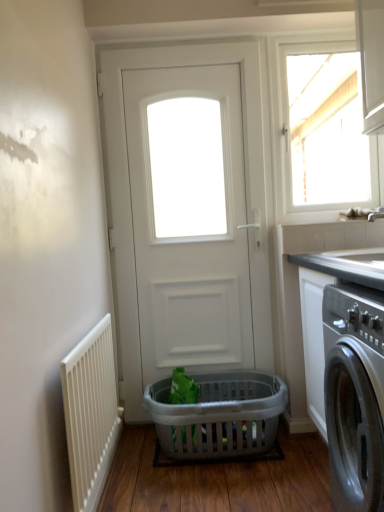
What do you see at coordinates (219, 415) in the screenshot? I see `translucent plastic basket at lower center` at bounding box center [219, 415].

What is the approximate width of translucent plastic basket at lower center?

18.19 inches.

Describe the element at coordinates (321, 309) in the screenshot. I see `smooth gray countertop at right` at that location.

Identify the location of white plastic radiator at lower left. The width and height of the screenshot is (384, 512). (90, 414).

From a real-world perspective, which is physically below, translucent plastic basket at lower center or white glossy window at upper right?

translucent plastic basket at lower center is physically lower.

Does translucent plastic basket at lower center have a greater width compared to white glossy window at upper right?

Correct, the width of translucent plastic basket at lower center exceeds that of white glossy window at upper right.

Is translucent plastic basket at lower center turned away from white glossy window at upper right?

That's not correct — translucent plastic basket at lower center is not looking away from white glossy window at upper right.

The image size is (384, 512). I want to click on door above the white plastic radiator at lower left (from the image's perspective), so point(246,174).

Between white matte door at center and white plastic radiator at lower left, which one has larger width?

With larger width is white matte door at center.

From a real-world perspective, between white matte door at center and white plastic radiator at lower left, who is vertically lower?

white plastic radiator at lower left is physically lower.

Can you see white matte door at center touching white plastic radiator at lower left?

No, white matte door at center is not beside white plastic radiator at lower left.

Between white matte door at center and translucent plastic basket at lower center, which one is positioned in front?

Positioned in front is translucent plastic basket at lower center.

Considering the sizes of objects white matte door at center and translucent plastic basket at lower center in the image provided, who is wider, white matte door at center or translucent plastic basket at lower center?

translucent plastic basket at lower center.

Based on the photo, does white matte door at center turn towards translucent plastic basket at lower center?

Yes.

Between point (112, 194) and point (162, 387), which one is positioned in front?

Positioned in front is point (162, 387).

Between white plastic radiator at lower left and white matte door at center, which one has larger width?

white matte door at center.

Considering the relative sizes of white plastic radiator at lower left and white matte door at center in the image provided, is white plastic radiator at lower left shorter than white matte door at center?

Yes, white plastic radiator at lower left is shorter than white matte door at center.

From a real-world perspective, is white plastic radiator at lower left under white matte door at center?

Correct, in the physical world, white plastic radiator at lower left is lower than white matte door at center.

I want to click on door that appears behind the white plastic radiator at lower left, so click(x=246, y=174).

Is white glossy window at upper right next to translucent plastic basket at lower center and touching it?

No, white glossy window at upper right is not making contact with translucent plastic basket at lower center.

In order to click on basket below the white glossy window at upper right (from a real-world perspective) in this screenshot , I will do `click(219, 415)`.

How distant is white glossy window at upper right from translucent plastic basket at lower center?

The distance of white glossy window at upper right from translucent plastic basket at lower center is 10.32 feet.

Between white glossy window at upper right and translucent plastic basket at lower center, which one has larger size?

translucent plastic basket at lower center is bigger.

From the image's perspective, between translucent plastic basket at lower center and white plastic radiator at lower left, who is located below?

translucent plastic basket at lower center.

Does translucent plastic basket at lower center have a smaller size compared to white plastic radiator at lower left?

Actually, translucent plastic basket at lower center might be larger than white plastic radiator at lower left.

Could you tell me if translucent plastic basket at lower center is facing white plastic radiator at lower left?

No, translucent plastic basket at lower center is not oriented towards white plastic radiator at lower left.

Can you confirm if translucent plastic basket at lower center is taller than white plastic radiator at lower left?

In fact, translucent plastic basket at lower center may be shorter than white plastic radiator at lower left.

Is point (118, 411) in front of point (319, 323)?

No, (118, 411) is further to viewer.

Does white plastic radiator at lower left have a greater height compared to smooth gray countertop at right?

Incorrect, the height of white plastic radiator at lower left is not larger of that of smooth gray countertop at right.

At what (x,y) coordinates should I click in order to perform the action: click on basket in front of the white glossy window at upper right. Please return your answer as a coordinate pair (x, y). Looking at the image, I should click on (219, 415).

Where is `door that is behind the white plastic radiator at lower left`? This screenshot has height=512, width=384. door that is behind the white plastic radiator at lower left is located at coordinates (246, 174).

Considering their positions, is white glossy window at upper right positioned further to translucent plastic basket at lower center than white plastic radiator at lower left?

white glossy window at upper right is further to translucent plastic basket at lower center.

From the image, which object appears to be farther from white glossy window at upper right, translucent plastic basket at lower center or smooth gray countertop at right?

translucent plastic basket at lower center is positioned further to the anchor white glossy window at upper right.

Estimate the real-world distances between objects in this image. Which object is further from white matte door at center, smooth gray countertop at right or translucent plastic basket at lower center?

The object further to white matte door at center is smooth gray countertop at right.

Estimate the real-world distances between objects in this image. Which object is further from white plastic radiator at lower left, white matte door at center or white glossy window at upper right?

white glossy window at upper right is further to white plastic radiator at lower left.

Which object lies nearer to the anchor point translucent plastic basket at lower center, white plastic radiator at lower left or smooth gray countertop at right?

smooth gray countertop at right is closer to translucent plastic basket at lower center.

Looking at the image, which one is located further to translucent plastic basket at lower center, white plastic radiator at lower left or white matte door at center?

The object further to translucent plastic basket at lower center is white matte door at center.

Estimate the real-world distances between objects in this image. Which object is further from smooth gray countertop at right, white matte door at center or white plastic radiator at lower left?

white plastic radiator at lower left is further to smooth gray countertop at right.

In the scene shown: When comparing their distances from white glossy window at upper right, does smooth gray countertop at right or translucent plastic basket at lower center seem further?

Among the two, translucent plastic basket at lower center is located further to white glossy window at upper right.

What are the coordinates of `basket between white plastic radiator at lower left and white matte door at center in the front-back direction` in the screenshot? It's located at (219, 415).

Locate an element on the screen. door between white glossy window at upper right and white plastic radiator at lower left in the vertical direction is located at coordinates (246, 174).

You are a GUI agent. You are given a task and a screenshot of the screen. Output one action in this format:
    pyautogui.click(x=<x>, y=<y>)
    Task: Click on the radiator between white glossy window at upper right and translucent plastic basket at lower center from top to bottom
    
    Given the screenshot: What is the action you would take?
    pyautogui.click(x=90, y=414)

At what (x,y) coordinates should I click in order to perform the action: click on door between white plastic radiator at lower left and smooth gray countertop at right. Please return your answer as a coordinate pair (x, y). Looking at the image, I should click on (246, 174).